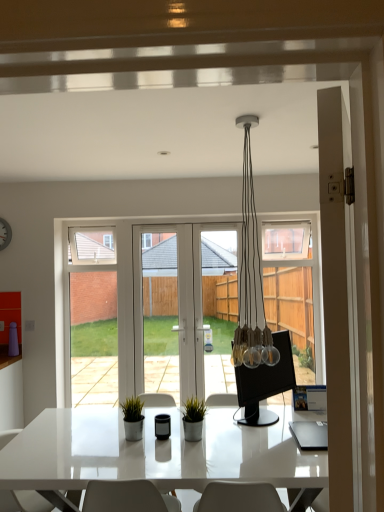
Question: Considering the positions of clear glass door at center, the second screen door in the right-to-left sequence, and white glass screen door at left, which appears as the third screen door when viewed from the right, in the image, is clear glass door at center, the second screen door in the right-to-left sequence, taller or shorter than white glass screen door at left, which appears as the third screen door when viewed from the right,?

Choices:
 (A) tall
 (B) short

Answer: (B)

Question: Choose the correct answer: Is clear glass door at center, marked as the 2th screen door in a left-to-right arrangement, inside white glass screen door at left, the first screen door viewed from the left, or outside it?

Choices:
 (A) inside
 (B) outside

Answer: (B)

Question: Which is nearer to the white glossy chair at lower left?

Choices:
 (A) green matte plant at center
 (B) clear glass door at center, the second screen door in the right-to-left sequence
 (C) black glossy monitor at center
 (D) white matte clock at upper left
 (E) white glossy screen door at center, the 1th screen door in the right-to-left sequence

Answer: (A)

Question: Which object is positioned farthest from the white matte door at right?

Choices:
 (A) white glossy desk at center
 (B) clear glass door at center, marked as the 2th screen door in a left-to-right arrangement
 (C) white glass screen door at left, the first screen door viewed from the left
 (D) black glossy monitor at center
 (E) green matte plant at center

Answer: (C)